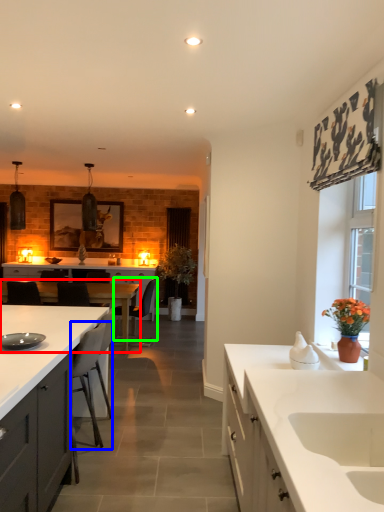
Question: Which object is positioned closest to table (highlighted by a red box)? Select from chair (highlighted by a blue box) and chair (highlighted by a green box).

Choices:
 (A) chair
 (B) chair

Answer: (B)